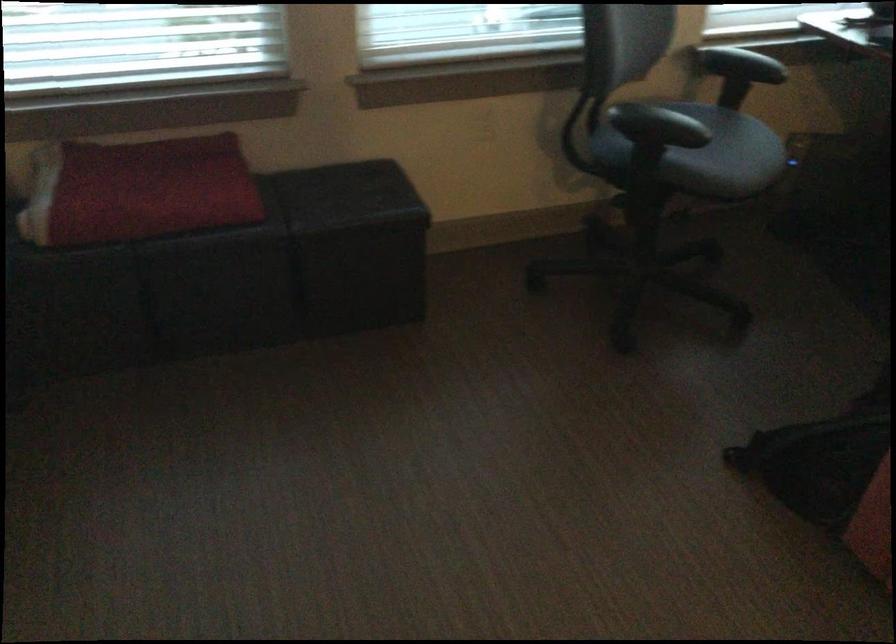
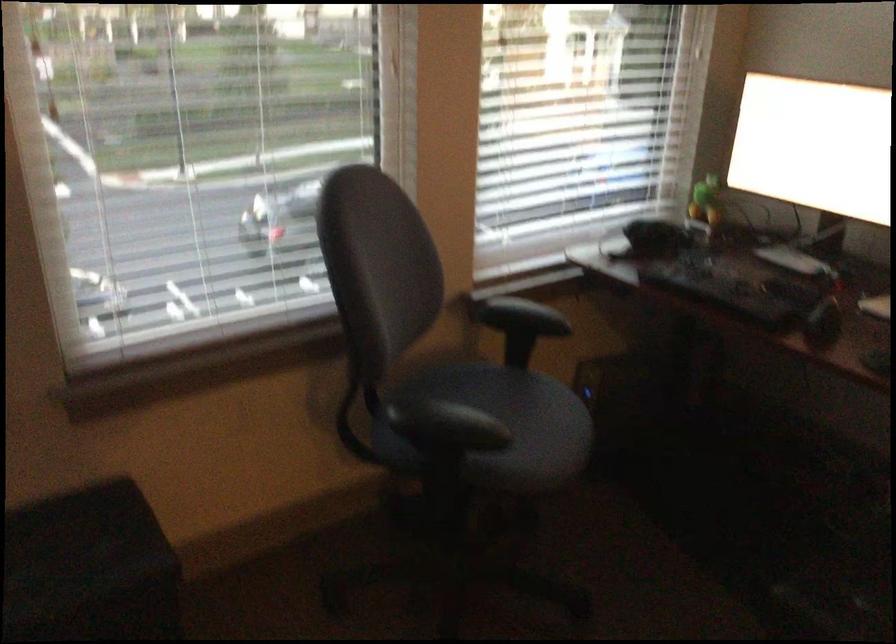
Looking at this image, what movement of the cameraman would produce the second image?

The movement direction of the cameraman is right, forward.